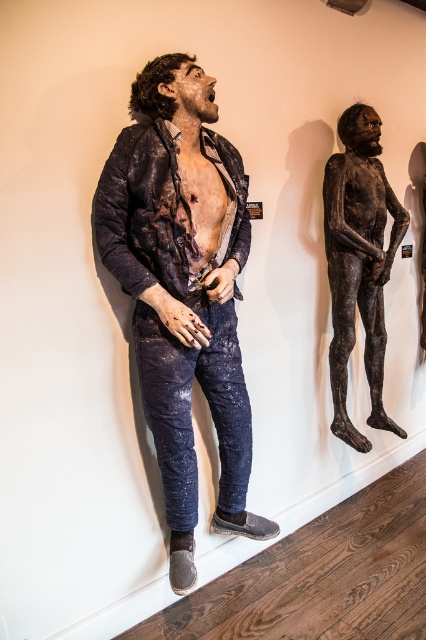
Question: Which object is farther from the camera taking this photo?

Choices:
 (A) distressed denim jacket at center
 (B) bronze statue at right

Answer: (B)

Question: Which point is farther to the camera?

Choices:
 (A) bronze statue at right
 (B) distressed denim jacket at center

Answer: (A)

Question: Which object is closer to the camera taking this photo?

Choices:
 (A) distressed denim jacket at center
 (B) bronze statue at right

Answer: (A)

Question: Can you confirm if distressed denim jacket at center is bigger than bronze statue at right?

Choices:
 (A) yes
 (B) no

Answer: (A)

Question: Can you confirm if distressed denim jacket at center is positioned above bronze statue at right?

Choices:
 (A) yes
 (B) no

Answer: (B)

Question: Can you confirm if distressed denim jacket at center is positioned above bronze statue at right?

Choices:
 (A) yes
 (B) no

Answer: (B)